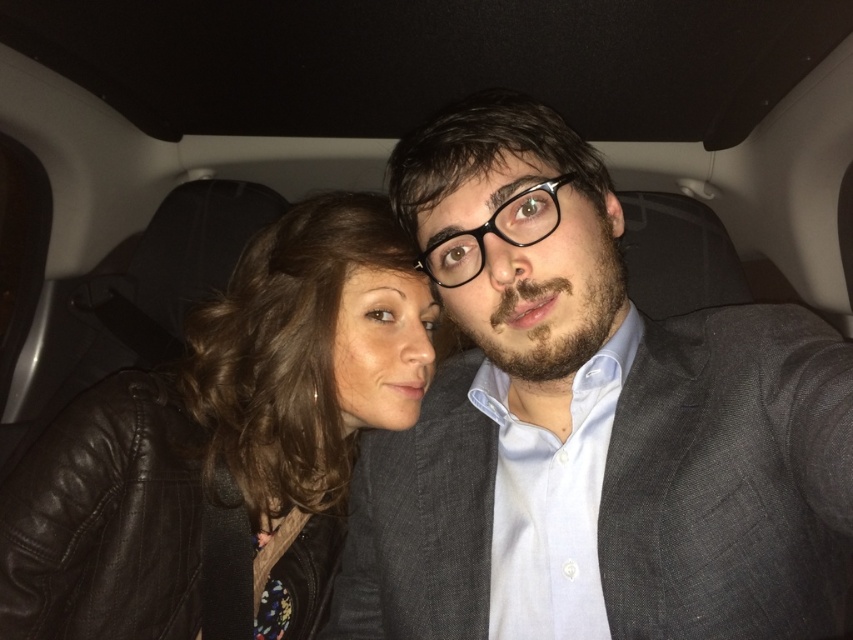
Question: Which of the following is the farthest from the observer?

Choices:
 (A) (729, 451)
 (B) (231, 387)

Answer: (B)

Question: Observing the image, what is the correct spatial positioning of gray textured suit at center in reference to black leather jacket at left?

Choices:
 (A) right
 (B) left

Answer: (A)

Question: Does gray textured suit at center appear on the left side of black leather jacket at left?

Choices:
 (A) no
 (B) yes

Answer: (A)

Question: Is gray textured suit at center above black leather jacket at left?

Choices:
 (A) yes
 (B) no

Answer: (A)